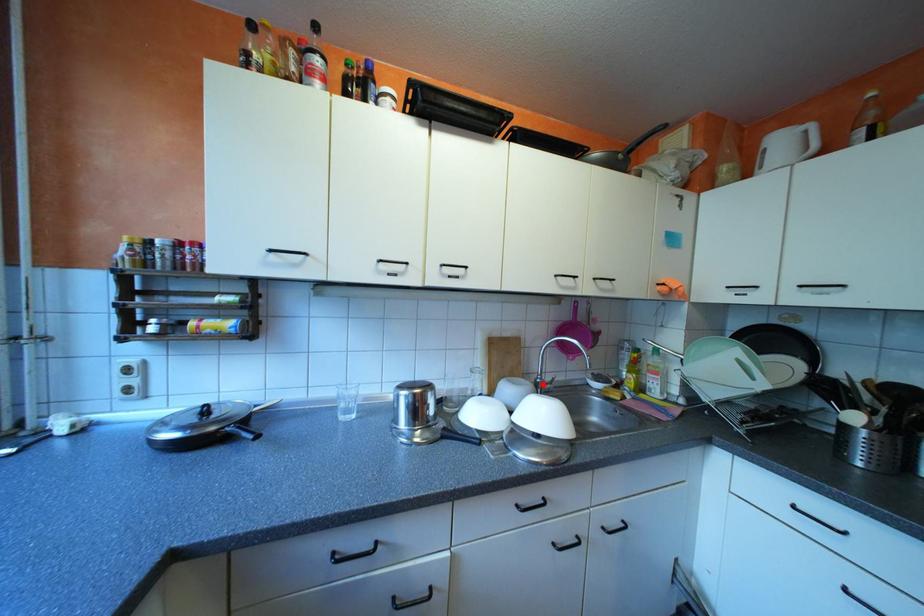
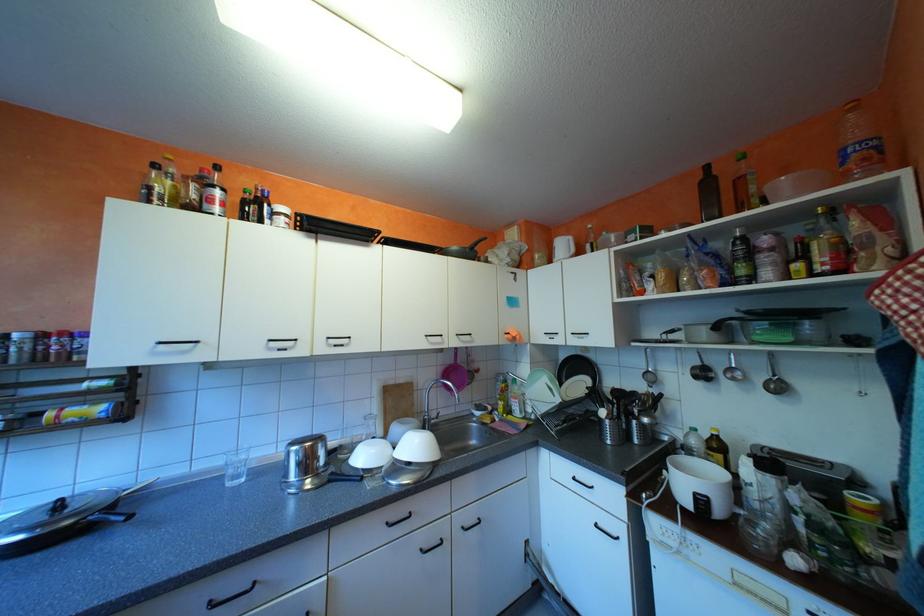
Find the pixel in the second image that matches the highlighted location in the first image.

(428, 422)